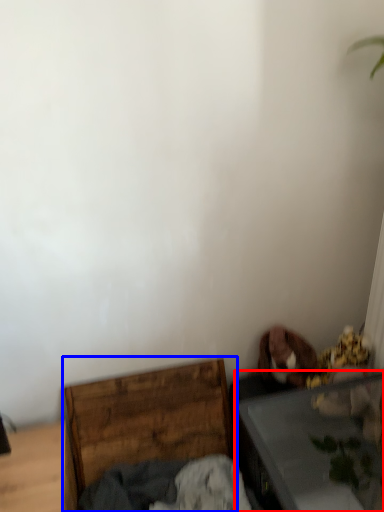
Question: Among these objects, which one is nearest to the camera, table (highlighted by a red box) or furniture (highlighted by a blue box)?

Choices:
 (A) table
 (B) furniture

Answer: (A)